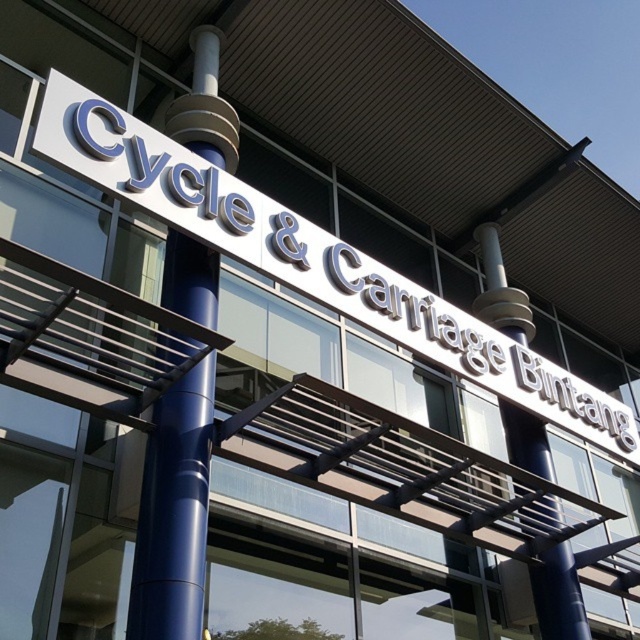
Question: Is white glossy sign at upper center wider than blue polished metal pole at center?

Choices:
 (A) no
 (B) yes

Answer: (B)

Question: Can you confirm if white glossy sign at upper center is smaller than blue polished metal pole at center?

Choices:
 (A) no
 (B) yes

Answer: (A)

Question: Which point appears closest to the camera in this image?

Choices:
 (A) (104, 154)
 (B) (176, 472)

Answer: (B)

Question: Which point appears closest to the camera in this image?

Choices:
 (A) (189, 404)
 (B) (92, 150)

Answer: (A)

Question: Is white glossy sign at upper center below blue polished metal pole at center?

Choices:
 (A) no
 (B) yes

Answer: (A)

Question: Which point is farther to the camera?

Choices:
 (A) blue polished metal pole at center
 (B) white glossy sign at upper center

Answer: (B)